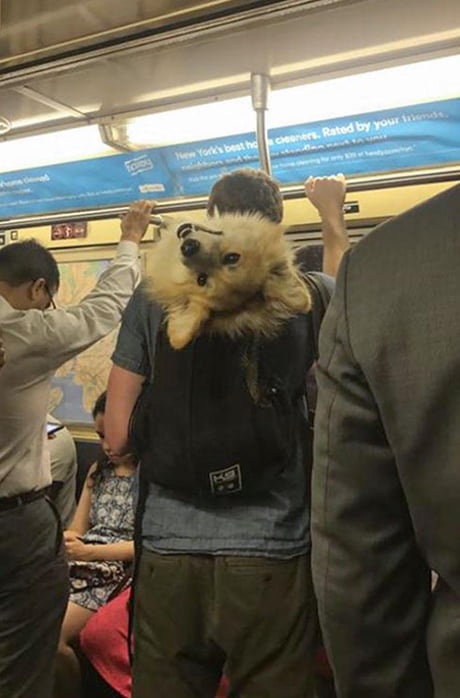
Image resolution: width=460 pixels, height=698 pixels. Find the location of `lights`. lights is located at coordinates (376, 89), (66, 142).